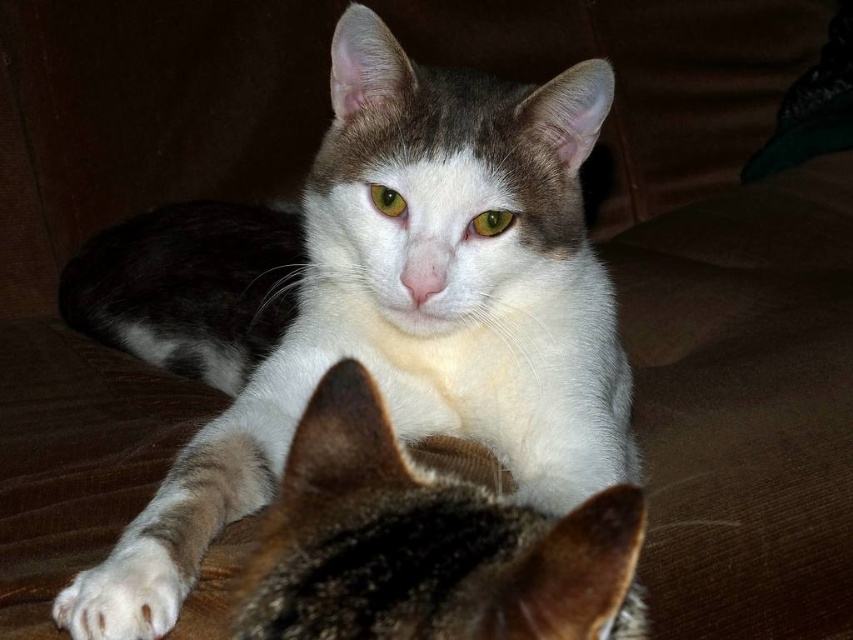
Question: Is white fur at center smaller than white fluffy paw at lower left?

Choices:
 (A) yes
 (B) no

Answer: (B)

Question: Which point appears closest to the camera in this image?

Choices:
 (A) (178, 582)
 (B) (521, 611)
 (C) (228, 314)

Answer: (B)

Question: Does white fur at center appear over white fluffy paw at lower left?

Choices:
 (A) no
 (B) yes

Answer: (B)

Question: In this image, where is white fur at center located relative to white fluffy paw at lower left?

Choices:
 (A) above
 (B) below

Answer: (A)

Question: Which object appears closest to the camera in this image?

Choices:
 (A) white fur cat at center
 (B) white fur at center

Answer: (B)

Question: Which is farther from the white fluffy paw at lower left?

Choices:
 (A) white fur at center
 (B) white fur cat at center

Answer: (B)